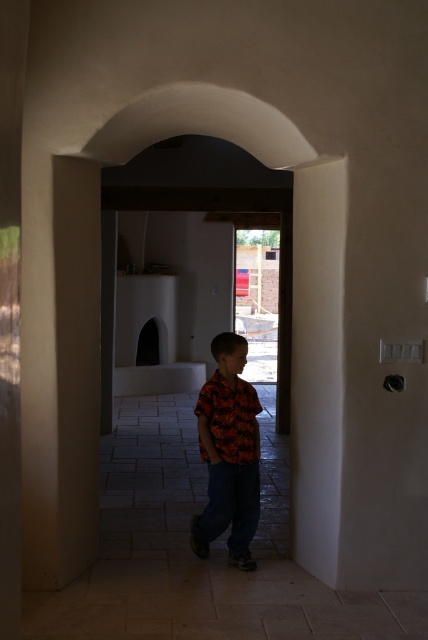
You are standing in the room and want to exit through the arched doorway. There is a smooth beige pillar at left and an orange printed shirt at center in your way. Which object is blocking your path more towards the left side?

The smooth beige pillar at left is positioned over orange printed shirt at center, so it is blocking the path more towards the left side.

You are standing in the room and want to move from the smooth beige pillar at left to the orange printed shirt at center. Which direction should you move?

You should move to the right because the smooth beige pillar at left is to the left of the orange printed shirt at center.

You are a delivery robot with a width of 0.8 meters. You need to navigate through the space between the smooth beige pillar at left and the orange printed shirt at center to reach the delivery point outside. Can you fit through the gap?

The smooth beige pillar at left and orange printed shirt at center are 1.04 meters apart from each other. Since the robot is 0.8 meters wide, it can fit through the gap as the distance between them is wider than the robot.